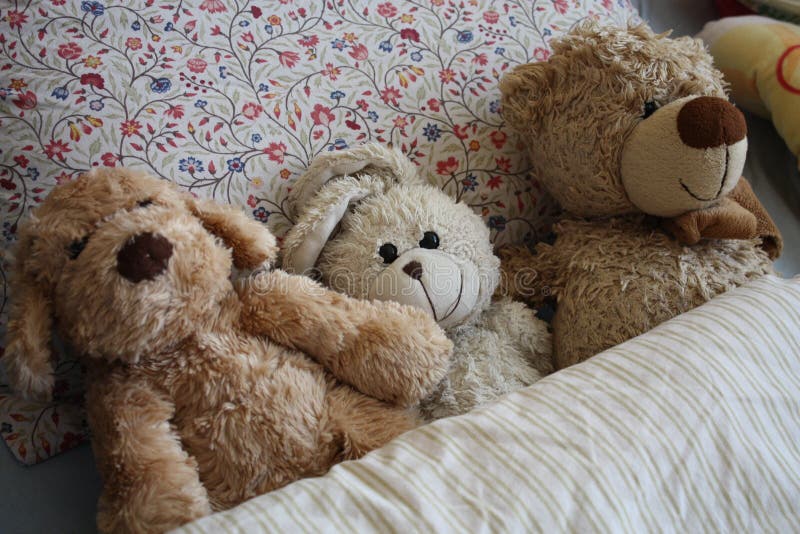
Where is `grey and white pillow`? This screenshot has height=534, width=800. grey and white pillow is located at coordinates (630, 380).